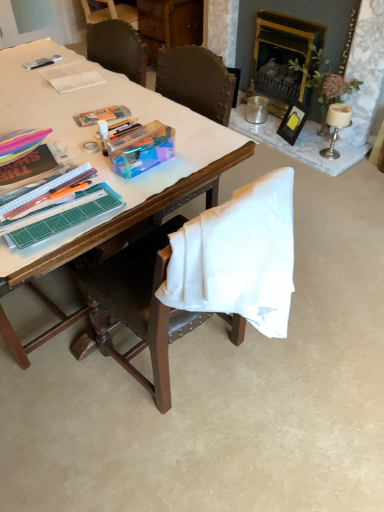
You are a GUI agent. You are given a task and a screenshot of the screen. Output one action in this format:
    pyautogui.click(x=<x>, y=<y>)
    Task: Click on the vacant space to the left of white paper at upper left
    The width and height of the screenshot is (384, 512).
    Given the screenshot: What is the action you would take?
    click(x=25, y=71)